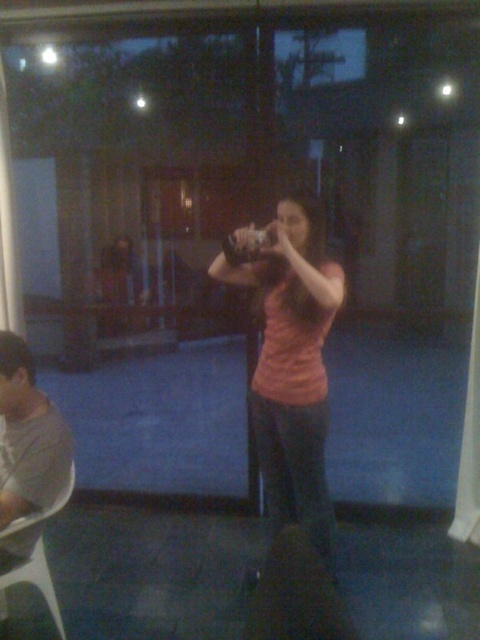
Question: Is pink matte shirt at center to the right of white plastic chair at lower left from the viewer's perspective?

Choices:
 (A) no
 (B) yes

Answer: (B)

Question: Which point is closer to the camera?

Choices:
 (A) (313, 492)
 (B) (48, 589)

Answer: (B)

Question: Can you confirm if pink matte shirt at center is wider than white plastic chair at lower left?

Choices:
 (A) no
 (B) yes

Answer: (B)

Question: Can you confirm if pink matte shirt at center is smaller than white plastic chair at lower left?

Choices:
 (A) no
 (B) yes

Answer: (A)

Question: Which point is farther from the camera taking this photo?

Choices:
 (A) (37, 541)
 (B) (308, 289)

Answer: (B)